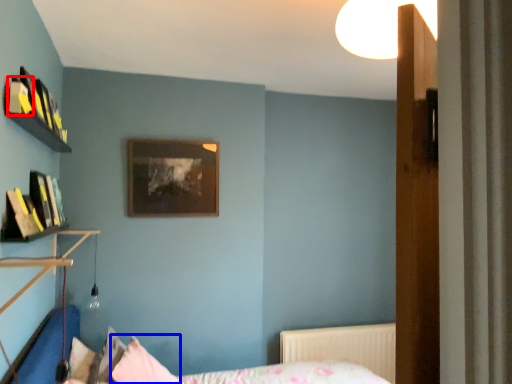
Question: Which object is further to the camera taking this photo, book (highlighted by a red box) or pillow (highlighted by a blue box)?

Choices:
 (A) book
 (B) pillow

Answer: (B)